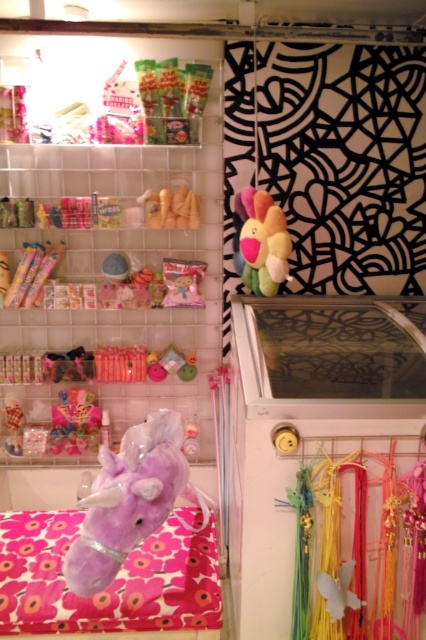
Is pink matte candy at upper left thinner than soft plush toy at center?

No.

Which is in front, point (166, 168) or point (256, 253)?

Point (256, 253) is more forward.

Does point (86, 243) come farther from viewer compared to point (270, 291)?

Yes, point (86, 243) is behind point (270, 291).

Where is `pink matte candy at upper left`? The width and height of the screenshot is (426, 640). pink matte candy at upper left is located at coordinates (126, 259).

Based on the photo, who is more distant from viewer, (118, 506) or (278, 262)?

The point (278, 262) is more distant.

Is purple plush unicorn at center closer to the viewer compared to soft plush toy at center?

Yes, purple plush unicorn at center is in front of soft plush toy at center.

Is point (149, 424) in front of point (278, 289)?

Yes.

The image size is (426, 640). I want to click on purple plush unicorn at center, so click(x=131, y=500).

Based on the photo, does pink matte candy at upper left appear over purple plush unicorn at center?

Correct, pink matte candy at upper left is located above purple plush unicorn at center.

Can you confirm if pink matte candy at upper left is bigger than purple plush unicorn at center?

Yes.

Image resolution: width=426 pixels, height=640 pixels. I want to click on pink matte candy at upper left, so click(126, 259).